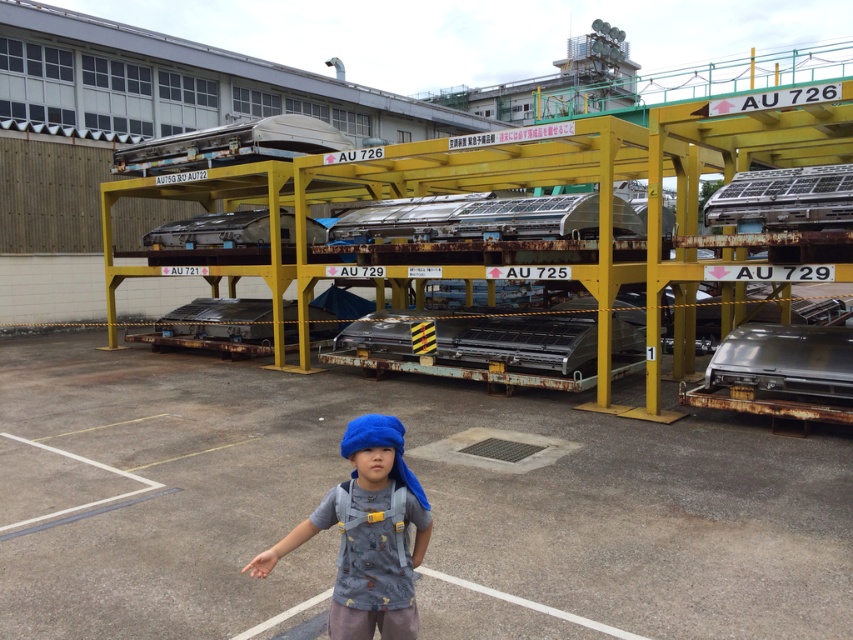
Does blue fabric headband at center appear on the left side of shiny metallic car at right?

Indeed, blue fabric headband at center is positioned on the left side of shiny metallic car at right.

Is blue fabric headband at center bigger than shiny metallic car at right?

No, blue fabric headband at center is not bigger than shiny metallic car at right.

Which is behind, point (386, 532) or point (808, 390)?

The point (808, 390) is more distant.

The height and width of the screenshot is (640, 853). I want to click on blue fabric headband at center, so click(368, 534).

Who is positioned more to the right, rusty metal car at center or shiny metallic car at right?

From the viewer's perspective, shiny metallic car at right appears more on the right side.

How distant is rusty metal car at center from shiny metallic car at right?

rusty metal car at center and shiny metallic car at right are 10.49 feet apart from each other.

Is point (421, 348) closer to viewer compared to point (802, 330)?

No.

I want to click on rusty metal car at center, so click(479, 344).

Is gray concrete parking lot at center below rusty metal car at center?

Correct, gray concrete parking lot at center is located below rusty metal car at center.

Does gray concrete parking lot at center appear over rusty metal car at center?

No.

Does point (831, 461) come in front of point (549, 385)?

Yes.

Identify the location of gray concrete parking lot at center. (426, 492).